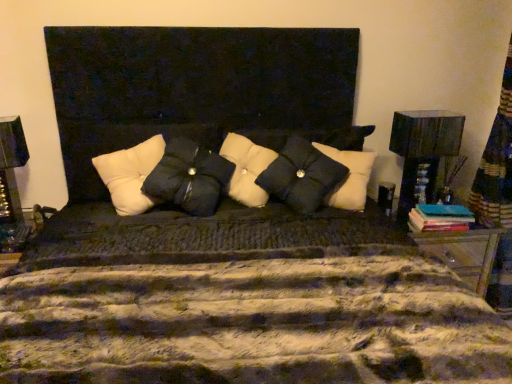
Question: In which direction should I rotate to look at black textured pillow at center, the first pillow positioned from the right?

Choices:
 (A) right
 (B) left

Answer: (A)

Question: Which direction should I rotate to look at white tufted pillow at center, positioned as the 1th pillow in left-to-right order?

Choices:
 (A) right
 (B) left

Answer: (B)

Question: Considering the relative sizes of teal matte book at right and black matte pillow at center, placed as the second pillow when sorted from left to right, in the image provided, is teal matte book at right taller than black matte pillow at center, placed as the second pillow when sorted from left to right,?

Choices:
 (A) yes
 (B) no

Answer: (B)

Question: Is teal matte book at right facing towards black matte pillow at center, which is the second pillow in right-to-left order?

Choices:
 (A) yes
 (B) no

Answer: (B)

Question: Is teal matte book at right thinner than black matte pillow at center, which is the second pillow in right-to-left order?

Choices:
 (A) yes
 (B) no

Answer: (A)

Question: Considering the relative sizes of teal matte book at right and black matte pillow at center, placed as the second pillow when sorted from left to right, in the image provided, is teal matte book at right bigger than black matte pillow at center, placed as the second pillow when sorted from left to right,?

Choices:
 (A) yes
 (B) no

Answer: (B)

Question: From a real-world perspective, is teal matte book at right under black matte pillow at center, placed as the second pillow when sorted from left to right?

Choices:
 (A) yes
 (B) no

Answer: (A)

Question: Is teal matte book at right at the left side of black matte pillow at center, which is the second pillow in right-to-left order?

Choices:
 (A) yes
 (B) no

Answer: (B)

Question: Can you confirm if black textured pillow at center, the first pillow positioned from the right, is positioned to the left of white tufted pillow at center, positioned as the 1th pillow in left-to-right order?

Choices:
 (A) no
 (B) yes

Answer: (A)

Question: Is black textured pillow at center, the first pillow positioned from the right, oriented towards white tufted pillow at center, arranged as the 3th pillow when viewed from the right?

Choices:
 (A) yes
 (B) no

Answer: (B)

Question: Is black textured pillow at center, marked as the 3th pillow in a left-to-right arrangement, located outside white tufted pillow at center, positioned as the 1th pillow in left-to-right order?

Choices:
 (A) no
 (B) yes

Answer: (B)

Question: From a real-world perspective, is black textured pillow at center, the first pillow positioned from the right, located higher than white tufted pillow at center, positioned as the 1th pillow in left-to-right order?

Choices:
 (A) no
 (B) yes

Answer: (B)

Question: Would you say black textured pillow at center, the first pillow positioned from the right, is a long distance from white tufted pillow at center, arranged as the 3th pillow when viewed from the right?

Choices:
 (A) no
 (B) yes

Answer: (A)

Question: Is the position of black textured pillow at center, marked as the 3th pillow in a left-to-right arrangement, less distant than that of white tufted pillow at center, positioned as the 1th pillow in left-to-right order?

Choices:
 (A) yes
 (B) no

Answer: (B)

Question: From a real-world perspective, is black matte pillow at center, placed as the second pillow when sorted from left to right, located higher than black textured pillow at center, marked as the 3th pillow in a left-to-right arrangement?

Choices:
 (A) yes
 (B) no

Answer: (A)